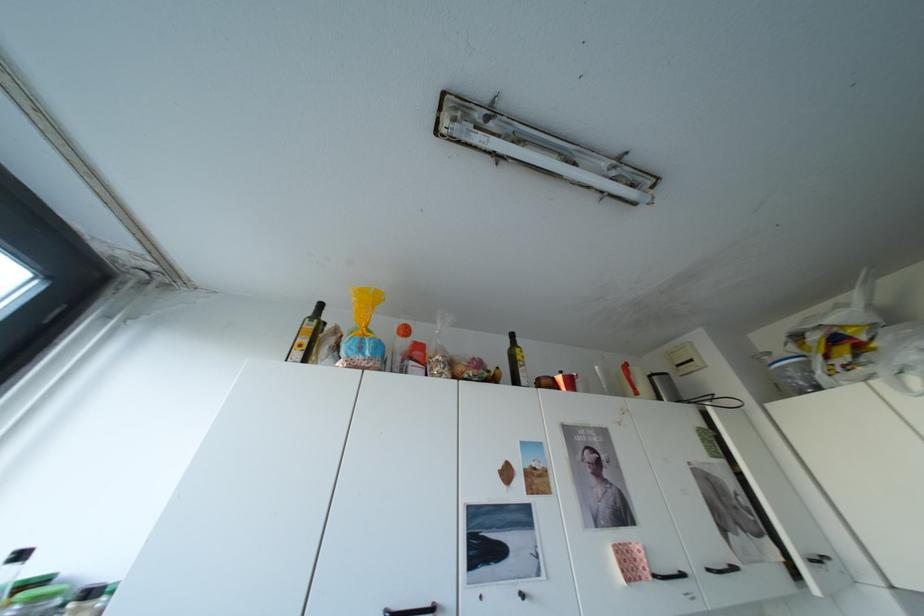
The height and width of the screenshot is (616, 924). What do you see at coordinates (628, 378) in the screenshot?
I see `the red moka pot` at bounding box center [628, 378].